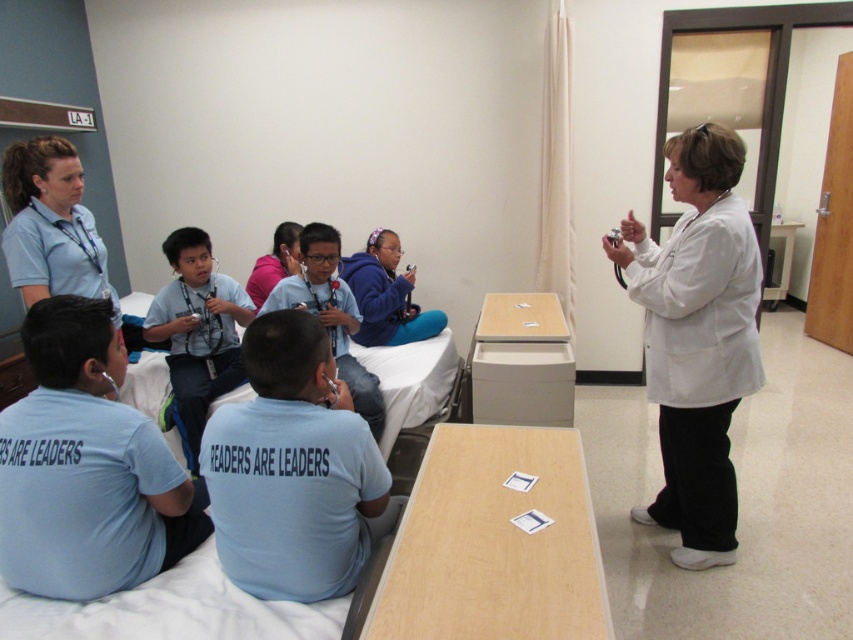
Based on the photo, you are a child participating in the activity and need to grab a coat to stay warm. The coats available are the white matte coat at right and the matte white coat at center. Which coat is easier to reach without moving from your current position?

The white matte coat at right is closer to the viewer than the matte white coat at center, so it is easier to reach without moving.

You are a photographer trying to capture a photo of the children in the scene. You notice the light blue cotton shirt at lower left and the white matte coat at right. Which clothing item should you focus on if you want to include both in the frame without moving the camera?

The light blue cotton shirt at lower left is positioned on the left side of the white matte coat at right, so focusing on the center between them would allow both to be included in the frame.